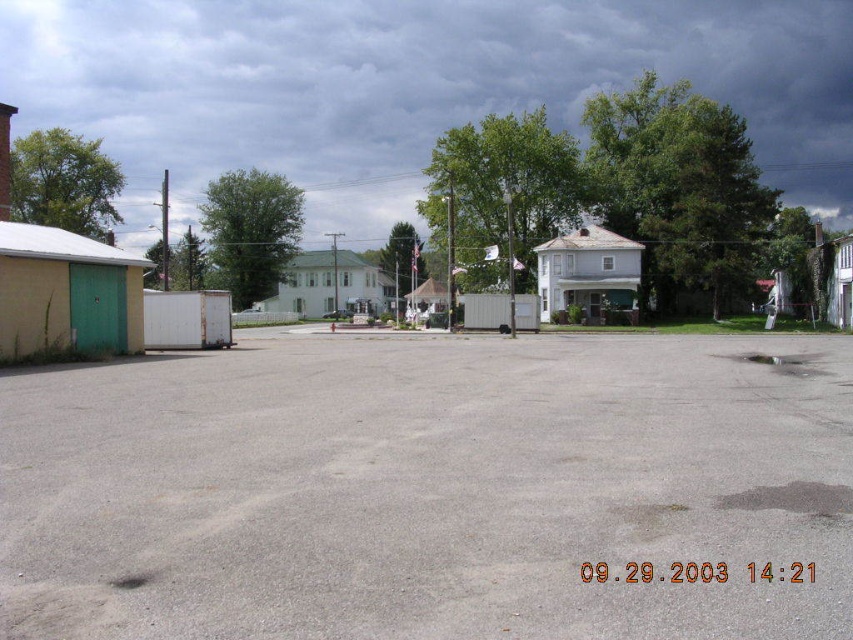
You are standing in the middle of the gray concrete parking lot at center and looking up at the dark cloudy sky at upper center. Which object is closer to you?

The gray concrete parking lot at center is closer to you than the dark cloudy sky at upper center.

You are a drone operator planning to capture aerial footage of the gray concrete parking lot at center and the dark cloudy sky at upper center. From your current position, which object is positioned to the right side?

The gray concrete parking lot at center is to the right of dark cloudy sky at upper center, so the gray concrete parking lot at center is positioned to the right side.